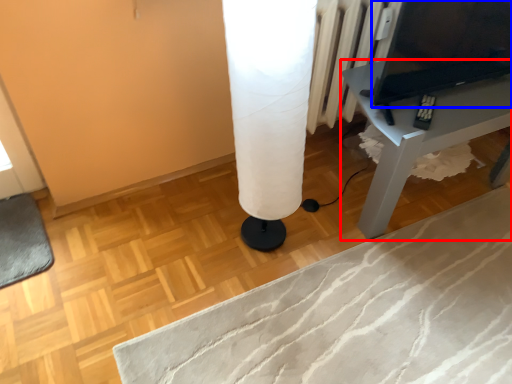
Question: Which of the following is the farthest to the observer, table (highlighted by a red box) or computer (highlighted by a blue box)?

Choices:
 (A) table
 (B) computer

Answer: (A)